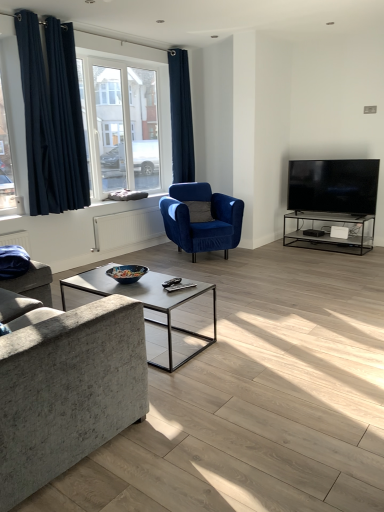
You are a GUI agent. You are given a task and a screenshot of the screen. Output one action in this format:
    pyautogui.click(x=<x>, y=<y>)
    Task: Click on the free spot to the right of textured gray fabric couch at left
    The width and height of the screenshot is (384, 512).
    Given the screenshot: What is the action you would take?
    pyautogui.click(x=266, y=362)